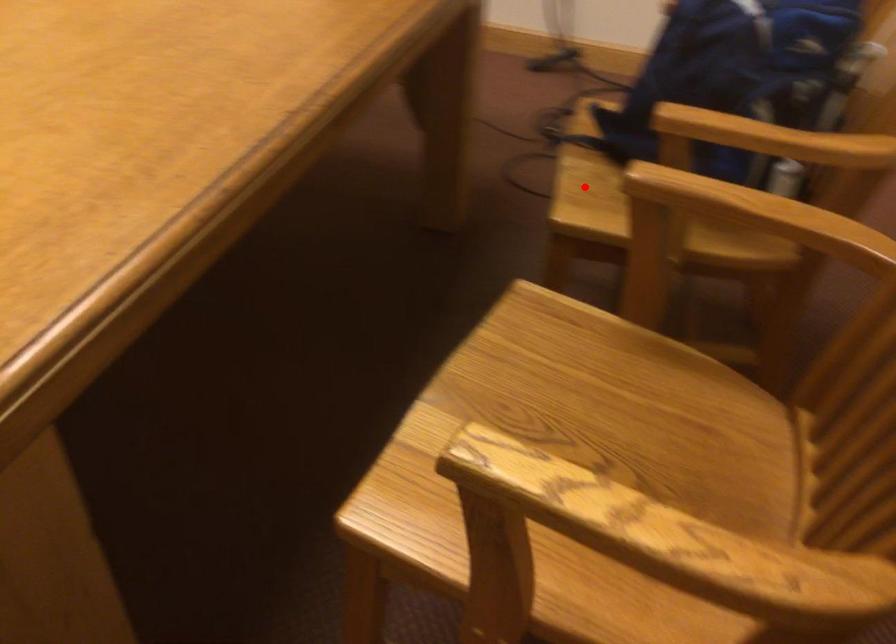
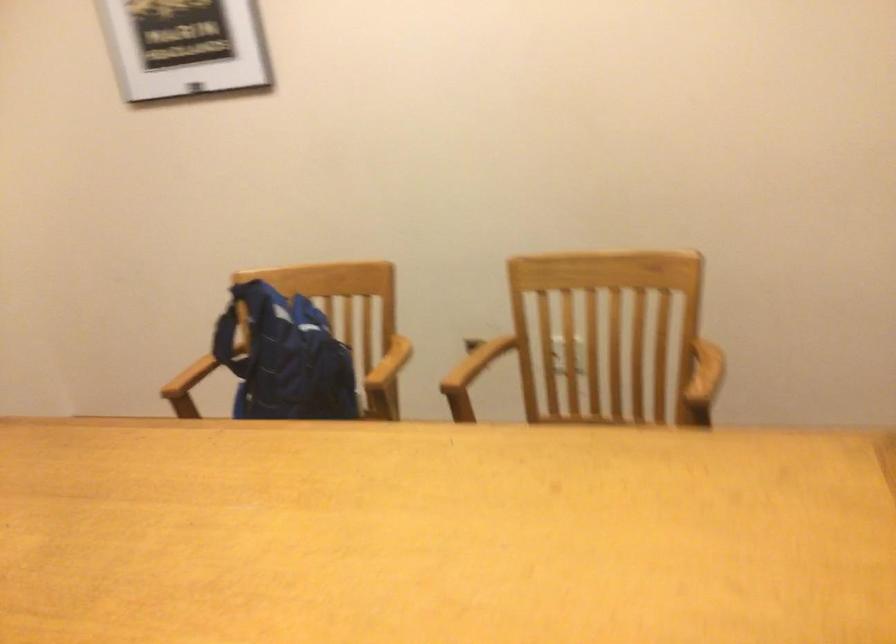
Question: I am providing you with two images of the same scene from different viewpoints. A red point is marked on the first image. Can you still see the location of the red point in image 2?

Choices:
 (A) Yes
 (B) No

Answer: (B)